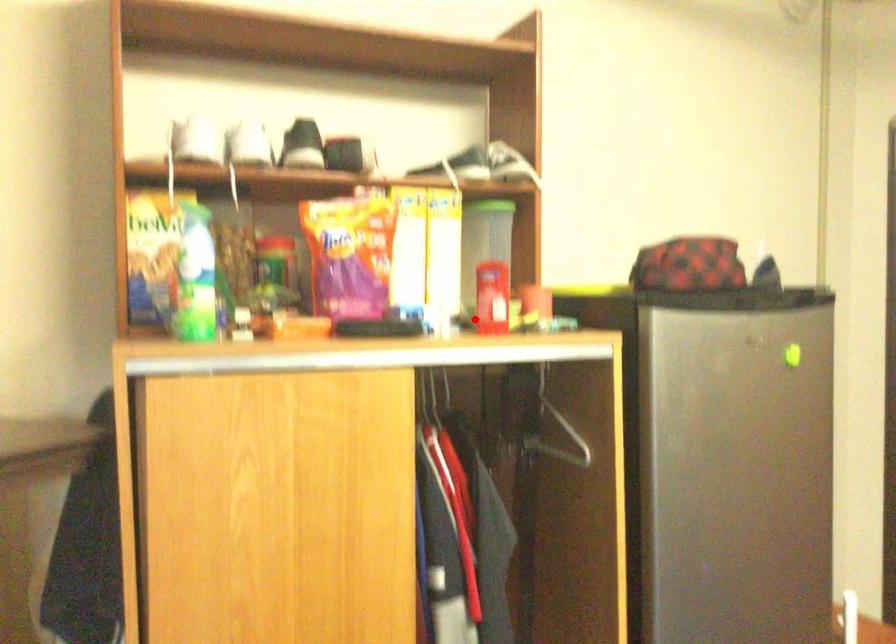
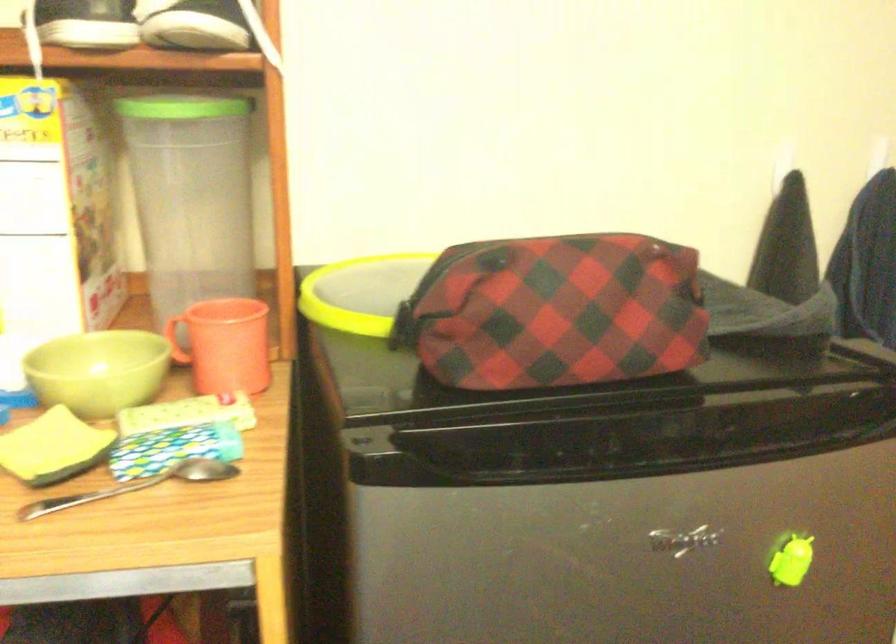
In the second image, find the point that corresponds to the highlighted location in the first image.

(98, 371)